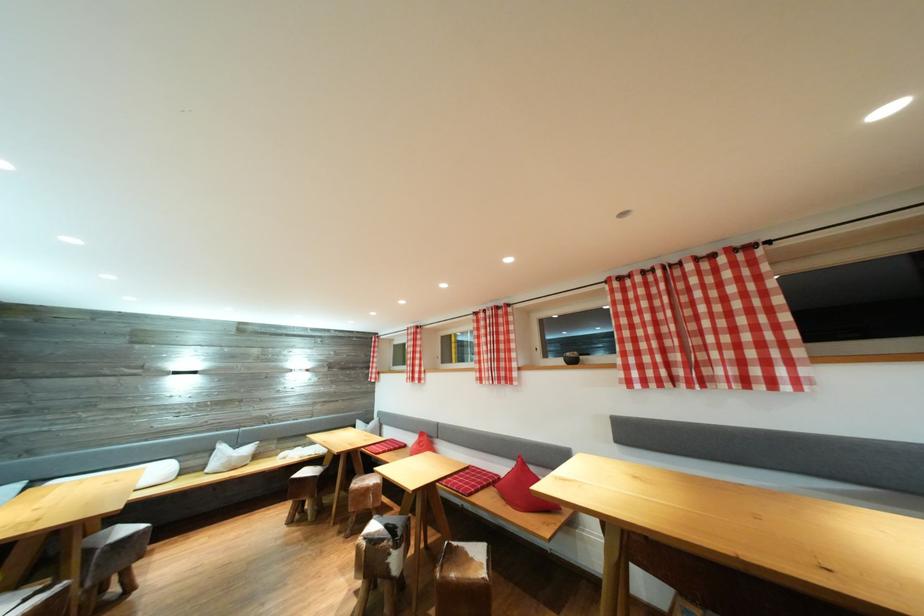
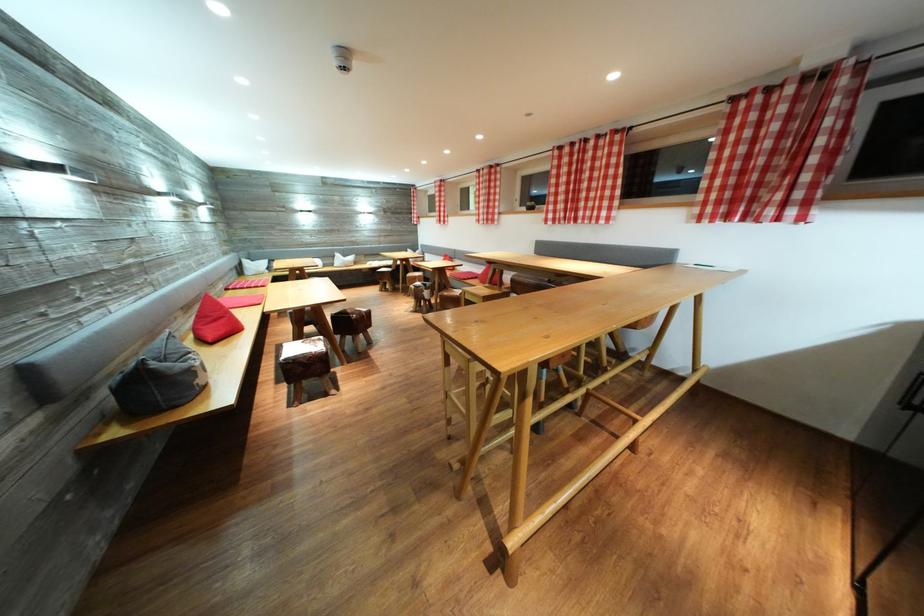
In the second image, find the point that corresponds to point 641,379 in the first image.

(556, 222)